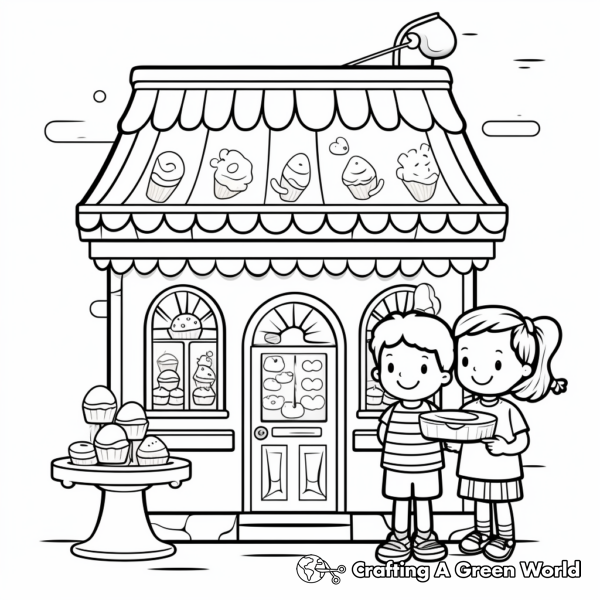
Locate an element on the screen. The width and height of the screenshot is (600, 600). knob is located at coordinates (262, 432).